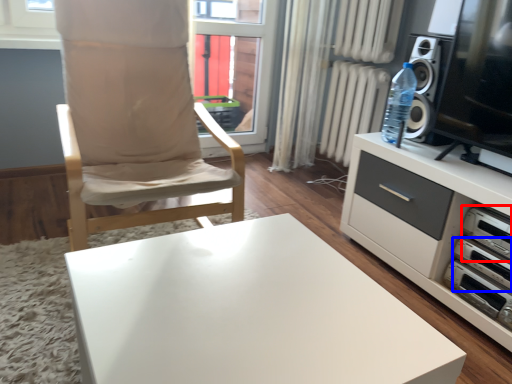
Question: Among these objects, which one is farthest to the camera, appliance (highlighted by a red box) or appliance (highlighted by a blue box)?

Choices:
 (A) appliance
 (B) appliance

Answer: (B)